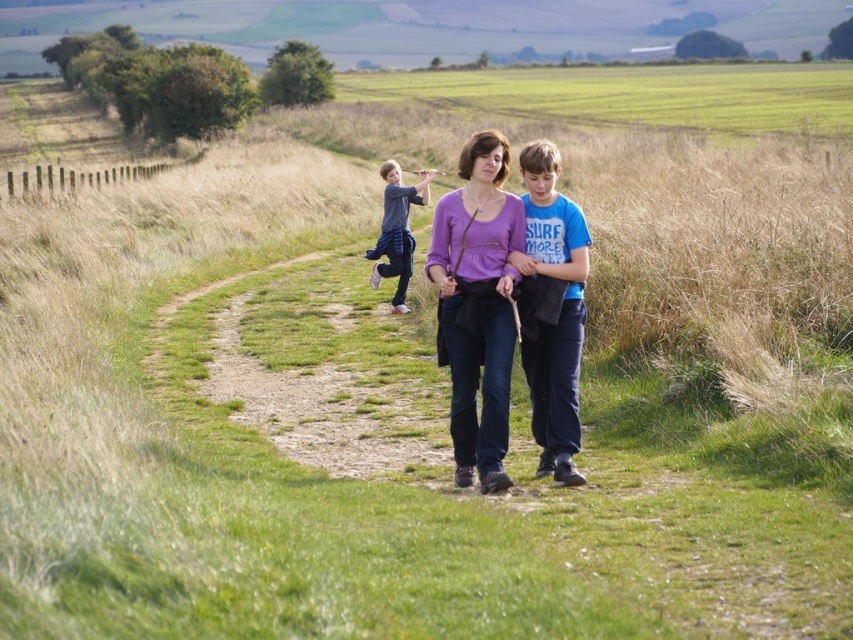
Based on the photo, who is positioned more to the left, blue cotton shirt at center or dark gray cotton shirt at center?

Positioned to the left is dark gray cotton shirt at center.

Is blue cotton shirt at center smaller than dark gray cotton shirt at center?

Yes.

What do you see at coordinates (558, 314) in the screenshot? The image size is (853, 640). I see `blue cotton shirt at center` at bounding box center [558, 314].

This screenshot has width=853, height=640. Identify the location of blue cotton shirt at center. (558, 314).

Which is above, purple matte shirt at center or dark gray cotton shirt at center?

dark gray cotton shirt at center is higher up.

Does purple matte shirt at center have a lesser width compared to dark gray cotton shirt at center?

Yes, purple matte shirt at center is thinner than dark gray cotton shirt at center.

Is point (436, 212) positioned before point (408, 205)?

Yes.

What are the coordinates of `purple matte shirt at center` in the screenshot? It's located at (477, 305).

Consider the image. Can you confirm if purple matte shirt at center is positioned to the left of blue cotton shirt at center?

Indeed, purple matte shirt at center is positioned on the left side of blue cotton shirt at center.

This screenshot has width=853, height=640. What do you see at coordinates (477, 305) in the screenshot?
I see `purple matte shirt at center` at bounding box center [477, 305].

Where is `purple matte shirt at center`? Image resolution: width=853 pixels, height=640 pixels. purple matte shirt at center is located at coordinates (477, 305).